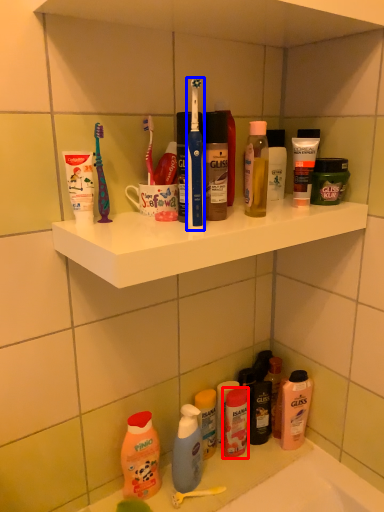
Question: Among these objects, which one is farthest to the camera, toiletry (highlighted by a red box) or toothbrush (highlighted by a blue box)?

Choices:
 (A) toiletry
 (B) toothbrush

Answer: (A)